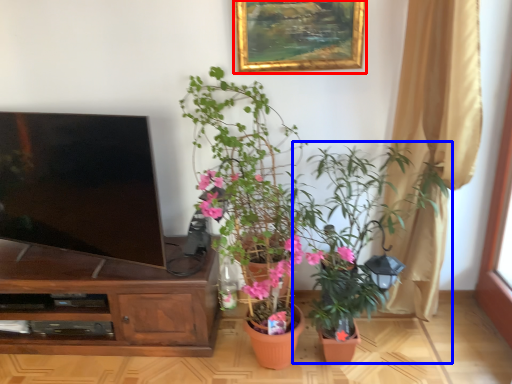
Question: Which of the following is the closest to the observer, picture frame (highlighted by a red box) or houseplant (highlighted by a blue box)?

Choices:
 (A) picture frame
 (B) houseplant

Answer: (B)